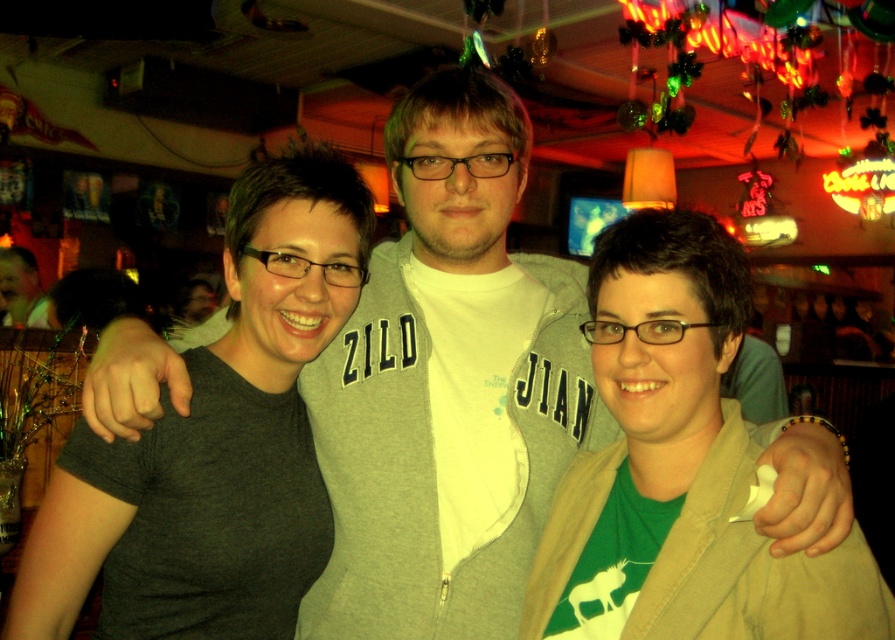
Question: Which of the following is the closest to the observer?

Choices:
 (A) (37, 272)
 (B) (124, 490)

Answer: (B)

Question: Is dark gray t-shirt at center below matte black shirt at left?

Choices:
 (A) yes
 (B) no

Answer: (A)

Question: Among these points, which one is nearest to the camera?

Choices:
 (A) (21, 262)
 (B) (254, 403)

Answer: (B)

Question: Does dark gray t-shirt at center appear over matte black shirt at left?

Choices:
 (A) yes
 (B) no

Answer: (B)

Question: Is dark gray t-shirt at center below matte black shirt at left?

Choices:
 (A) yes
 (B) no

Answer: (A)